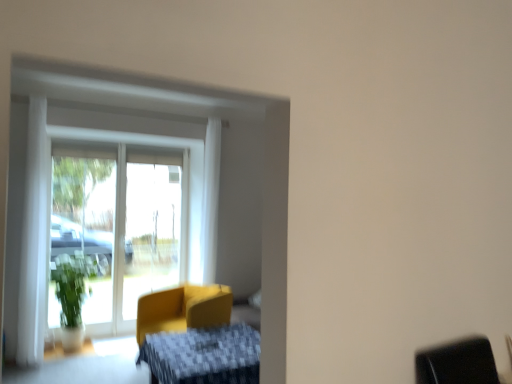
Question: Looking at their shapes, would you say textured yellow armchair at center is wider or thinner than matte yellow armchair at center?

Choices:
 (A) wide
 (B) thin

Answer: (A)

Question: From the image's perspective, relative to matte yellow armchair at center, is textured yellow armchair at center above or below?

Choices:
 (A) above
 (B) below

Answer: (B)

Question: Is textured yellow armchair at center taller or shorter than matte yellow armchair at center?

Choices:
 (A) tall
 (B) short

Answer: (B)

Question: Considering the positions of matte yellow armchair at center and textured yellow armchair at center in the image, is matte yellow armchair at center taller or shorter than textured yellow armchair at center?

Choices:
 (A) short
 (B) tall

Answer: (B)

Question: Is matte yellow armchair at center in front of or behind textured yellow armchair at center in the image?

Choices:
 (A) front
 (B) behind

Answer: (B)

Question: Considering the positions of matte yellow armchair at center and textured yellow armchair at center in the image, is matte yellow armchair at center wider or thinner than textured yellow armchair at center?

Choices:
 (A) wide
 (B) thin

Answer: (B)

Question: Is point (224, 294) closer or farther from the camera than point (157, 382)?

Choices:
 (A) farther
 (B) closer

Answer: (A)